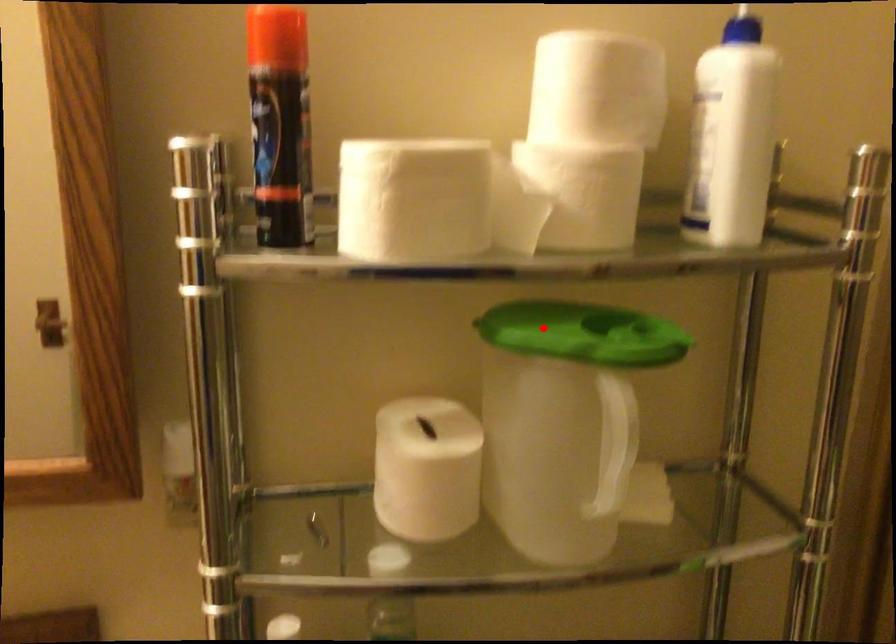
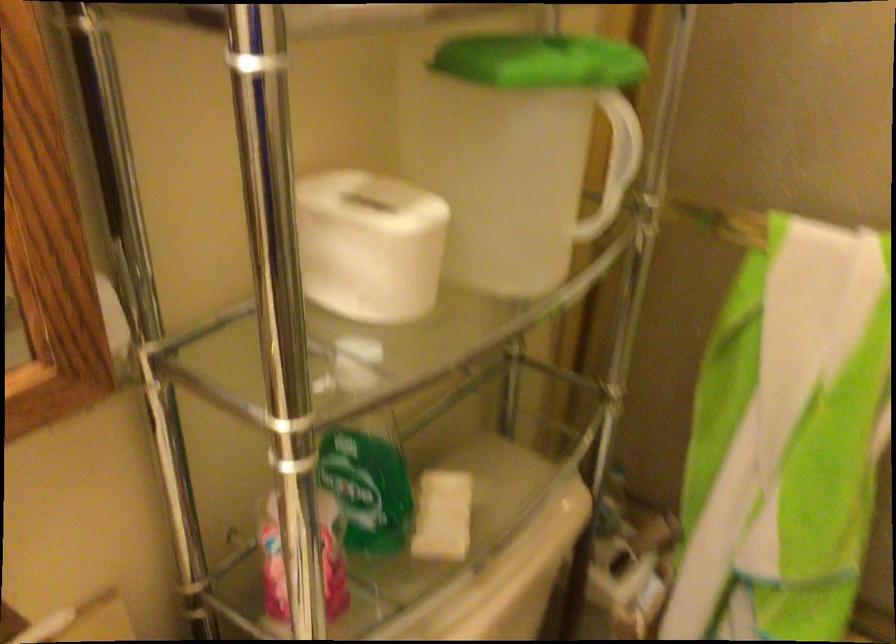
Find the pixel in the second image that matches the highlighted location in the first image.

(539, 61)